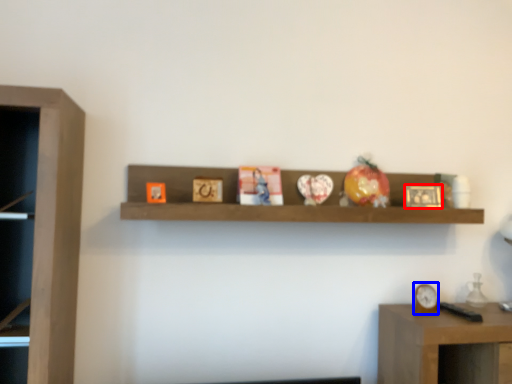
Question: Among these objects, which one is nearest to the camera, picture frame (highlighted by a red box) or clock (highlighted by a blue box)?

Choices:
 (A) picture frame
 (B) clock

Answer: (B)